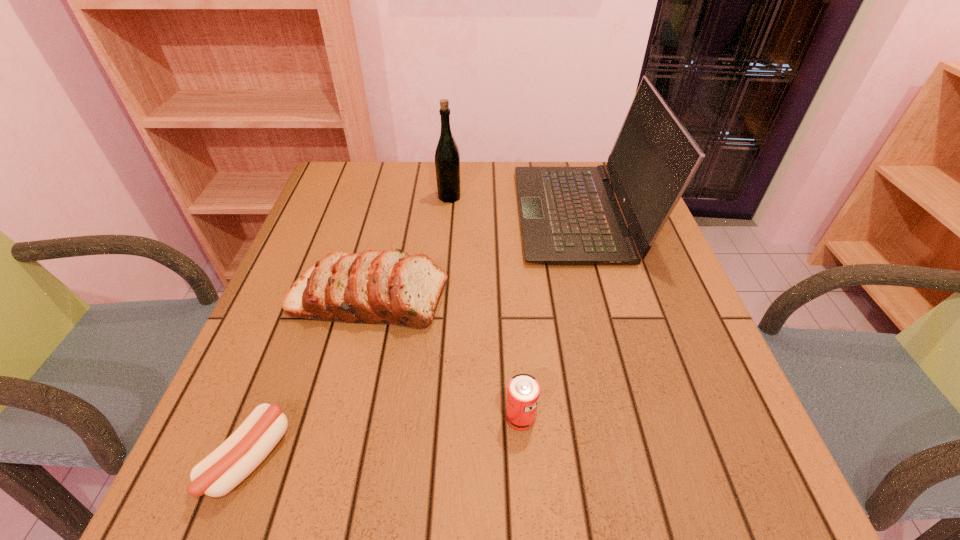
Where is `empty location between the sausage and the second object from right to left`? The height and width of the screenshot is (540, 960). empty location between the sausage and the second object from right to left is located at coordinates (385, 438).

Find the location of `vacant area that lies between the beer bottle and the sausage`. vacant area that lies between the beer bottle and the sausage is located at coordinates 349,328.

Identify the location of free area in between the can and the beer bottle. The height and width of the screenshot is (540, 960). (485, 307).

The width and height of the screenshot is (960, 540). I want to click on free space between the third nearest object and the beer bottle, so click(x=409, y=248).

This screenshot has height=540, width=960. In order to click on unoccupied area between the bread and the shortest object in this screenshot , I will do `click(309, 379)`.

Choose which object is the fourth nearest neighbor to the shortest object. Please provide its 2D coordinates. Your answer should be formatted as a tuple, i.e. [(x, y)], where the tuple contains the x and y coordinates of a point satisfying the conditions above.

[(447, 157)]

Identify which object is the second closest to the fourth object from left to right. Please provide its 2D coordinates. Your answer should be formatted as a tuple, i.e. [(x, y)], where the tuple contains the x and y coordinates of a point satisfying the conditions above.

[(243, 451)]

Locate an element on the screen. This screenshot has height=540, width=960. blank space that satisfies the following two spatial constraints: 1. on the back side of the shortest object; 2. on the left side of the can is located at coordinates (265, 417).

Find the location of a particular element. blank space that satisfies the following two spatial constraints: 1. on the front side of the bread; 2. on the left side of the second object from right to left is located at coordinates (339, 417).

I want to click on free point that satisfies the following two spatial constraints: 1. on the screen of the laptop computer; 2. on the front side of the can, so click(636, 417).